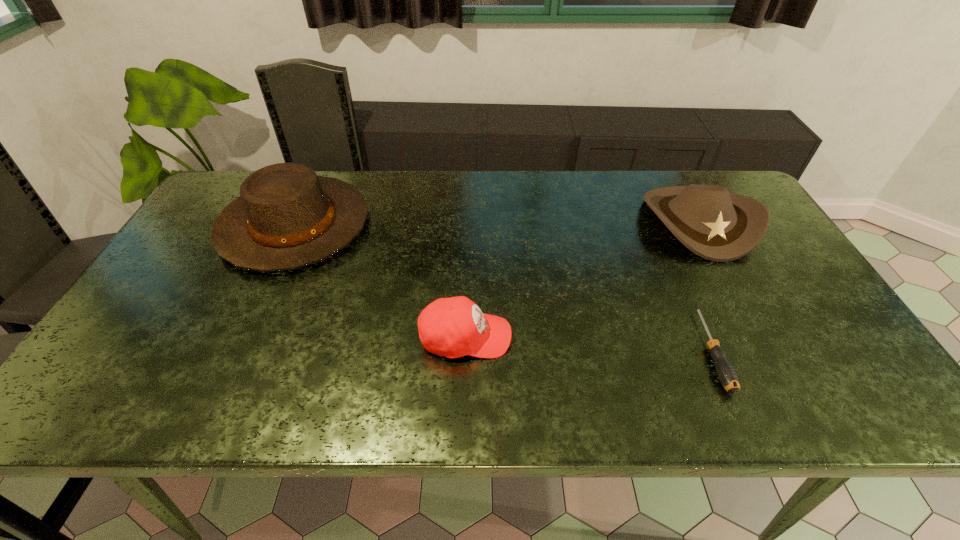
Find the location of a particular element. The width and height of the screenshot is (960, 540). the left cowboy hat is located at coordinates (287, 217).

You are a GUI agent. You are given a task and a screenshot of the screen. Output one action in this format:
    pyautogui.click(x=<x>, y=<y>)
    Task: Click on the leftmost object
    The height and width of the screenshot is (540, 960).
    Given the screenshot: What is the action you would take?
    [x=287, y=217]

In order to click on the shorter cowboy hat in this screenshot , I will do `click(719, 226)`.

This screenshot has height=540, width=960. Identify the location of the right cowboy hat. (719, 226).

The height and width of the screenshot is (540, 960). I want to click on the second object from left to right, so click(453, 327).

Image resolution: width=960 pixels, height=540 pixels. What are the coordinates of `the second shortest object` in the screenshot? It's located at (453, 327).

Where is `screwdriver`? This screenshot has height=540, width=960. screwdriver is located at coordinates (726, 373).

Identify the location of vacant space located on the front of the leftmost object. This screenshot has width=960, height=540. (214, 400).

Where is `free space located 0.310m with a star on the front of the shorter cowboy hat`? This screenshot has height=540, width=960. free space located 0.310m with a star on the front of the shorter cowboy hat is located at coordinates click(x=774, y=360).

Where is `free point located 0.090m on the front panel of the third object from right to left`? free point located 0.090m on the front panel of the third object from right to left is located at coordinates (550, 337).